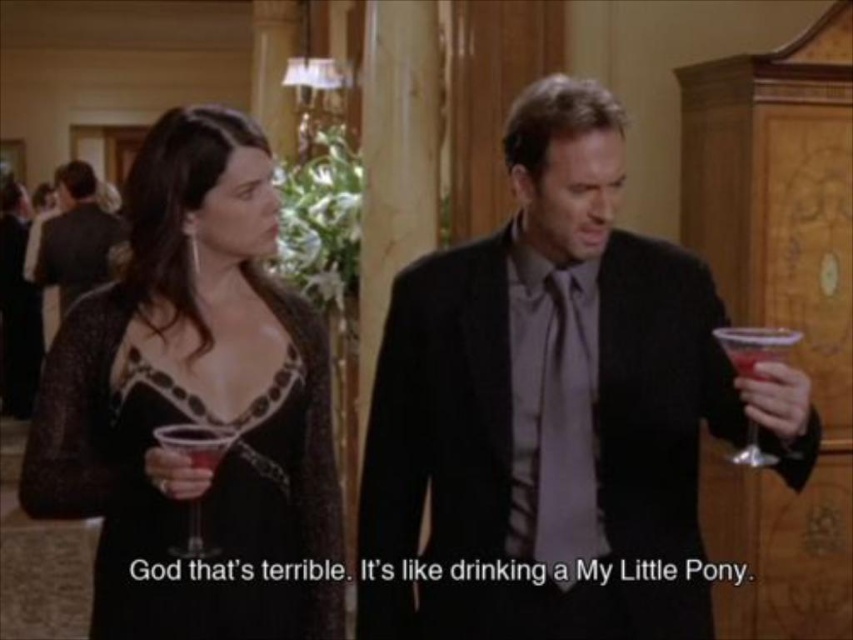
Can you confirm if transparent plastic wine glass at right is positioned to the left of translucent glass wine glass at center?

In fact, transparent plastic wine glass at right is to the right of translucent glass wine glass at center.

Image resolution: width=853 pixels, height=640 pixels. What do you see at coordinates (755, 346) in the screenshot? I see `transparent plastic wine glass at right` at bounding box center [755, 346].

Is point (781, 355) positioned behind point (209, 435)?

No, (781, 355) is closer to viewer.

Image resolution: width=853 pixels, height=640 pixels. I want to click on transparent plastic wine glass at right, so click(x=755, y=346).

What do you see at coordinates (195, 406) in the screenshot?
I see `black lace dress at center` at bounding box center [195, 406].

Can you confirm if black lace dress at center is thinner than translucent glass wine glass at center?

Incorrect, black lace dress at center's width is not less than translucent glass wine glass at center's.

Locate an element on the screen. This screenshot has height=640, width=853. black lace dress at center is located at coordinates (195, 406).

You are a GUI agent. You are given a task and a screenshot of the screen. Output one action in this format:
    pyautogui.click(x=<x>, y=<y>)
    Task: Click on the black lace dress at center
    This screenshot has height=640, width=853.
    Given the screenshot: What is the action you would take?
    pyautogui.click(x=195, y=406)

Consider the image. Which of these two, shiny black suit at center or black lace dress at center, stands taller?

shiny black suit at center

Who is more distant from viewer, (416, 476) or (169, 355)?

Positioned behind is point (416, 476).

Find the location of a particular element. shiny black suit at center is located at coordinates (555, 406).

Image resolution: width=853 pixels, height=640 pixels. In order to click on shiny black suit at center in this screenshot , I will do `click(555, 406)`.